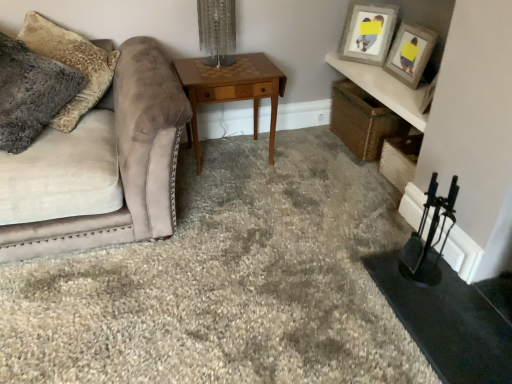
Locate an element on the screen. The height and width of the screenshot is (384, 512). vacant area that is in front of woodenobject at center is located at coordinates (236, 200).